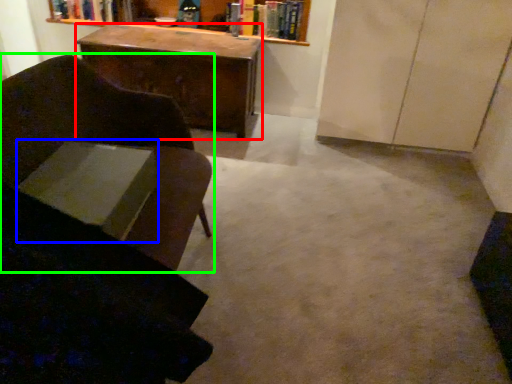
Question: Estimate the real-world distances between objects in this image. Which object is farther from desk (highlighted by a red box), book (highlighted by a blue box) or chair (highlighted by a green box)?

Choices:
 (A) book
 (B) chair

Answer: (A)